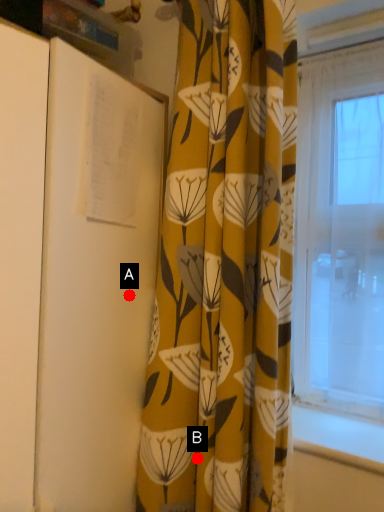
Question: Two points are circled on the image, labeled by A and B beside each circle. Which of the following is the closest to the observer?

Choices:
 (A) A is closer
 (B) B is closer

Answer: (A)